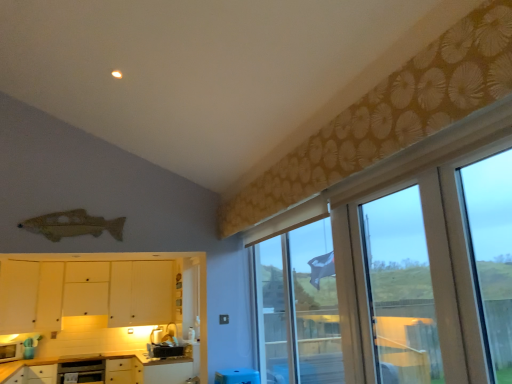
Question: Visually, is transparent plastic screen door at right positioned to the left or to the right of white glossy microwave at lower left, the first appliance viewed from the left?

Choices:
 (A) left
 (B) right

Answer: (B)

Question: From a real-world perspective, is transparent plastic screen door at right positioned above or below white glossy microwave at lower left, placed as the second appliance when sorted from right to left?

Choices:
 (A) below
 (B) above

Answer: (B)

Question: Which of these objects is positioned farthest from the white glossy microwave at lower left, placed as the second appliance when sorted from right to left?

Choices:
 (A) white matte cabinet at lower left, which ranks as the third cabinetry in bottom-to-top order
 (B) translucent glass window at upper right
 (C) metallic silver oven at lower left
 (D) white glossy table at lower center
 (E) matte black toaster at lower center, which appears as the 2th appliance when viewed from the left

Answer: (B)

Question: Which of these objects is positioned farthest from the white glossy microwave at lower left, placed as the second appliance when sorted from right to left?

Choices:
 (A) translucent glass window at upper right
 (B) white matte cabinet at lower left, arranged as the 2th cabinetry when viewed from the top
 (C) metallic silver oven at lower left
 (D) transparent plastic screen door at right
 (E) white matte cabinet at lower left, which is counted as the first cabinetry, starting from the top

Answer: (D)